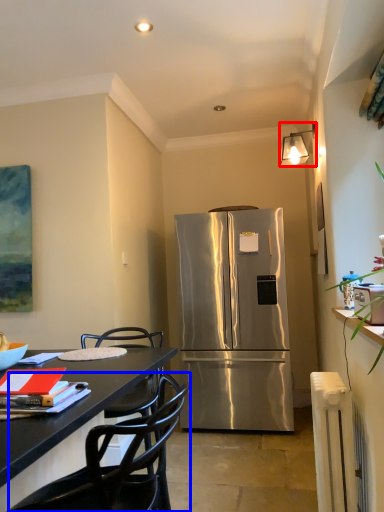
Question: Which object appears closest to the camera in this image, lamp (highlighted by a red box) or chair (highlighted by a blue box)?

Choices:
 (A) lamp
 (B) chair

Answer: (B)